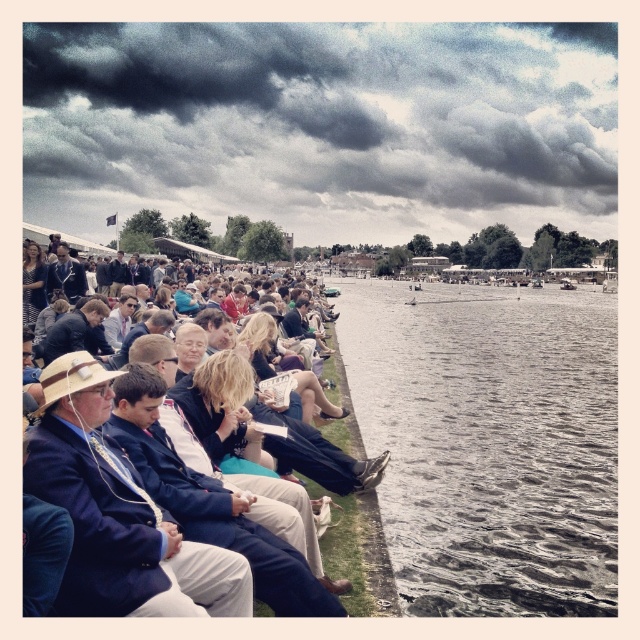
Who is taller, gray water at center or dark blue suit at center?

gray water at center

Looking at this image, who is shorter, gray water at center or dark blue suit at center?

With less height is dark blue suit at center.

Which is behind, point (554, 285) or point (230, 516)?

Positioned behind is point (554, 285).

I want to click on gray water at center, so click(490, 444).

Between dark cloudy sky at upper center and gray water at center, which one appears on the right side from the viewer's perspective?

Positioned to the right is gray water at center.

Can you confirm if dark cloudy sky at upper center is shorter than gray water at center?

In fact, dark cloudy sky at upper center may be taller than gray water at center.

Is point (497, 180) positioned behind point (381, 314)?

Yes, it is.

Locate an element on the screen. Image resolution: width=640 pixels, height=640 pixels. dark cloudy sky at upper center is located at coordinates (323, 125).

Is dark cloudy sky at upper center behind dark blue suit at center?

Yes.

Which is below, dark cloudy sky at upper center or dark blue suit at center?

dark blue suit at center is lower down.

Who is more distant from viewer, (x=600, y=198) or (x=269, y=557)?

Point (x=600, y=198)

Locate an element on the screen. dark cloudy sky at upper center is located at coordinates (323, 125).